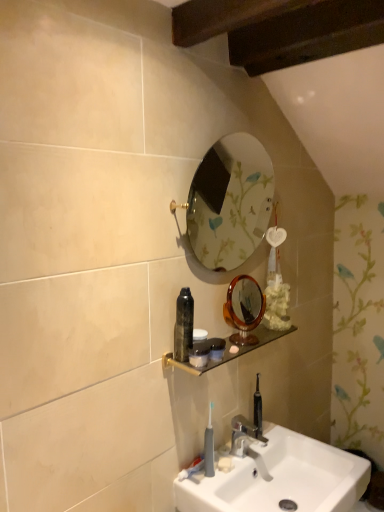
Question: From the image's perspective, is translucent plastic container at center above or below chrome metallic faucet at lower center?

Choices:
 (A) above
 (B) below

Answer: (A)

Question: Considering the positions of translucent plastic container at center and chrome metallic faucet at lower center in the image, is translucent plastic container at center bigger or smaller than chrome metallic faucet at lower center?

Choices:
 (A) small
 (B) big

Answer: (A)

Question: Based on their relative distances, which object is farther from the gold-framed mirror at upper center, which appears as the 2th mirror when ordered from the bottom?

Choices:
 (A) chrome metallic faucet at lower center
 (B) amber glass mirror at center, which is the 1th mirror from bottom to top
 (C) white ceramic sink at lower center
 (D) white matte soap at lower center
 (E) translucent plastic container at center

Answer: (D)

Question: Based on their relative distances, which object is nearer to the translucent plastic jar at shelf, the 1th mouthwash from the bottom?

Choices:
 (A) gold-framed mirror at upper center, which appears as the 2th mirror when ordered from the bottom
 (B) black glossy bottle at center, the 2th mouthwash positioned from the bottom
 (C) white matte soap at lower center
 (D) amber glass mirror at center, which is the 1th mirror from bottom to top
 (E) white ceramic sink at lower center

Answer: (B)